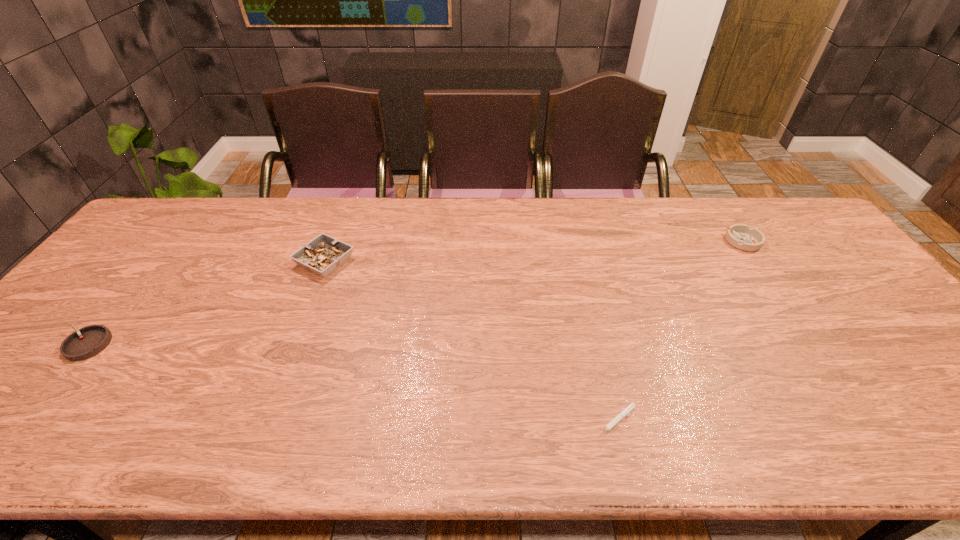
In order to click on free spot located on the back of the nearest object in this screenshot , I will do `click(585, 291)`.

Where is `object located in the far edge section of the desktop`? object located in the far edge section of the desktop is located at coordinates tap(741, 236).

What are the coordinates of `object that is at the near edge` in the screenshot? It's located at (624, 412).

Where is `object situated at the left edge`? This screenshot has width=960, height=540. object situated at the left edge is located at coordinates (89, 341).

The image size is (960, 540). What are the coordinates of `free space at the far edge of the desktop` in the screenshot? It's located at (485, 200).

Locate an element on the screen. The width and height of the screenshot is (960, 540). vacant space at the near edge of the desktop is located at coordinates (308, 433).

The width and height of the screenshot is (960, 540). In the image, there is a desktop. What are the coordinates of `free space at the left edge` in the screenshot? It's located at (103, 281).

The width and height of the screenshot is (960, 540). In order to click on vacant space at the right edge of the desktop in this screenshot , I will do `click(823, 258)`.

In the image, there is a desktop. In order to click on vacant space at the far left corner in this screenshot , I will do `click(183, 233)`.

The width and height of the screenshot is (960, 540). I want to click on free space at the near left corner of the desktop, so click(7, 442).